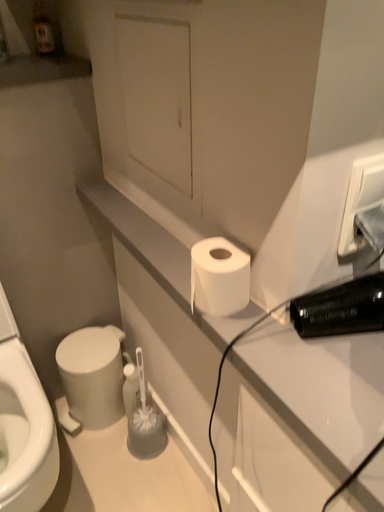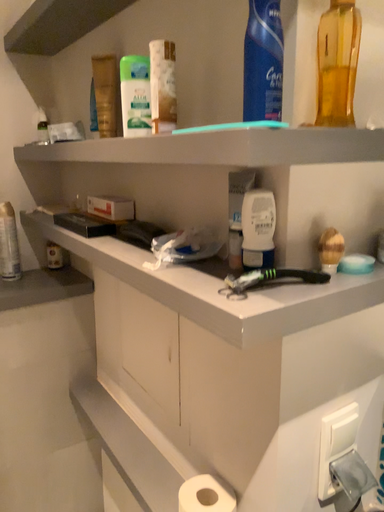
Question: How did the camera likely rotate when shooting the video?

Choices:
 (A) rotated downward
 (B) rotated upward

Answer: (B)